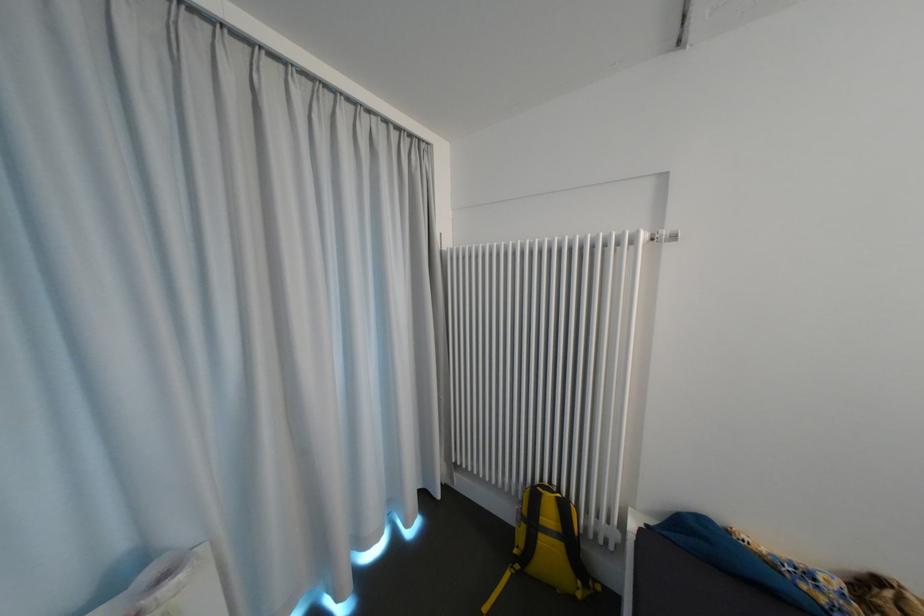
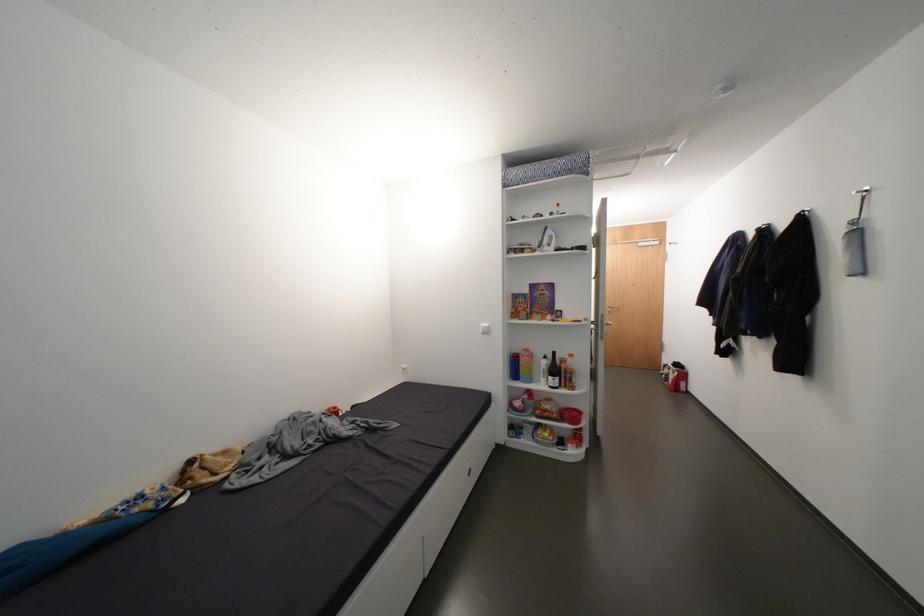
In the second image, find the point that corresponds to [797,570] in the first image.

(131, 508)